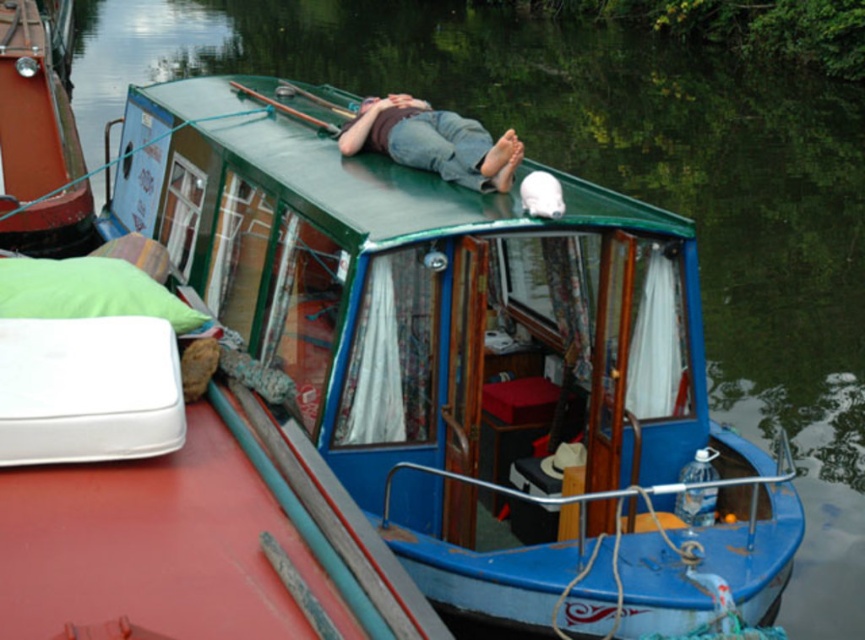
Looking at this image, you are a delivery drone operator. Your drone has a maximum load capacity of 10 kilograms. You need to transport the green fabric pillow at left from the blue glossy boat at upper center to a nearby dock. Given the boat is larger than the pillow, can the drone carry the pillow without exceeding its weight limit?

The blue glossy boat at upper center is larger than the green fabric pillow at left, but size does not determine weight. The question does not provide information about the pillow or boat weight, so it is impossible to determine if the drone can carry the pillow without exceeding its weight limit.